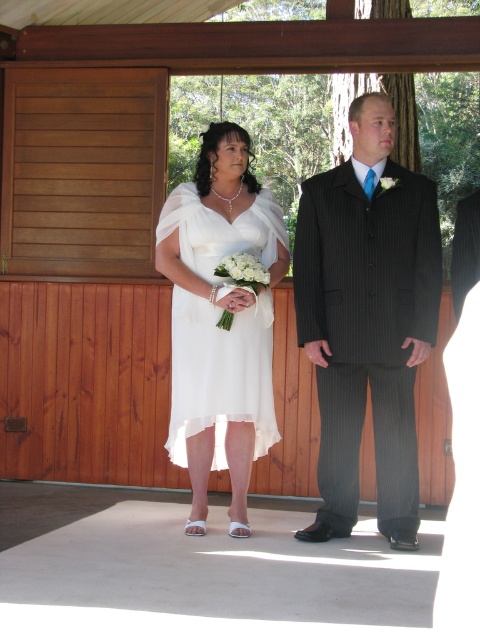
Question: Does black pinstripe suit at center have a lesser width compared to ivory chiffon dress at center?

Choices:
 (A) no
 (B) yes

Answer: (A)

Question: Is black pinstripe suit at center closer to the viewer compared to ivory chiffon dress at center?

Choices:
 (A) no
 (B) yes

Answer: (B)

Question: Which object appears farthest from the camera in this image?

Choices:
 (A) black pinstripe suit at center
 (B) ivory chiffon dress at center

Answer: (B)

Question: Which point is closer to the camera?

Choices:
 (A) (395, 275)
 (B) (248, 417)

Answer: (A)

Question: Is black pinstripe suit at center closer to the viewer compared to ivory chiffon dress at center?

Choices:
 (A) yes
 (B) no

Answer: (A)